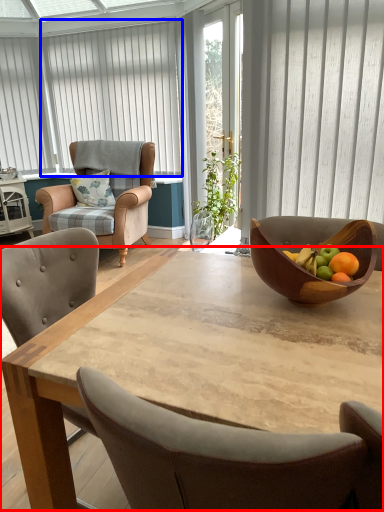
Question: Among these objects, which one is nearest to the camera, coffee table (highlighted by a red box) or curtain (highlighted by a blue box)?

Choices:
 (A) coffee table
 (B) curtain

Answer: (A)